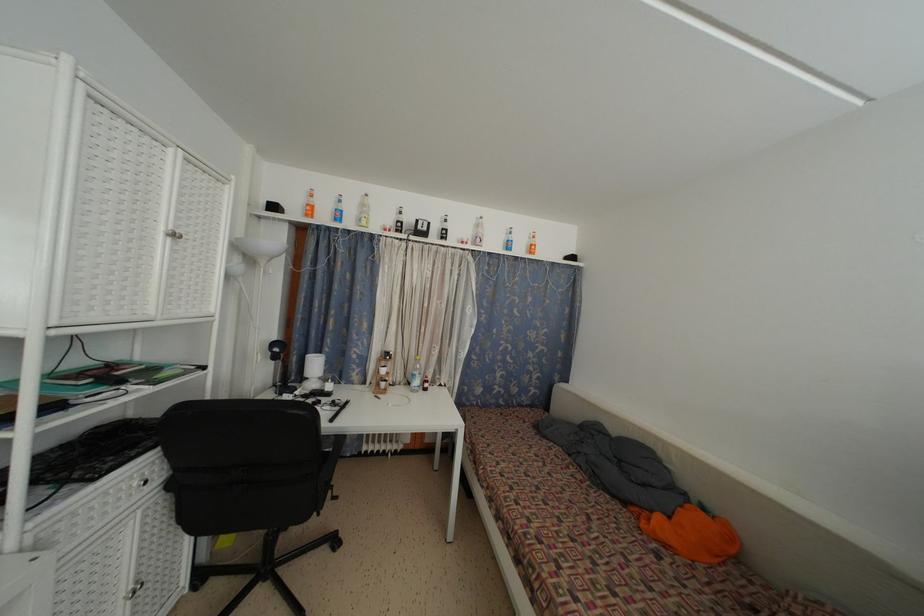
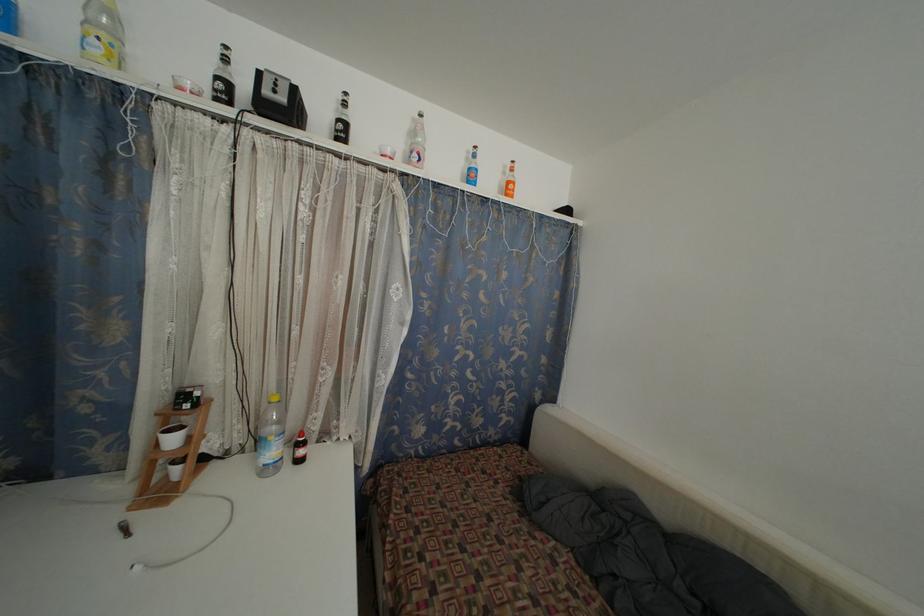
Where in the second image is the point corresponding to (448,237) from the first image?

(345, 132)